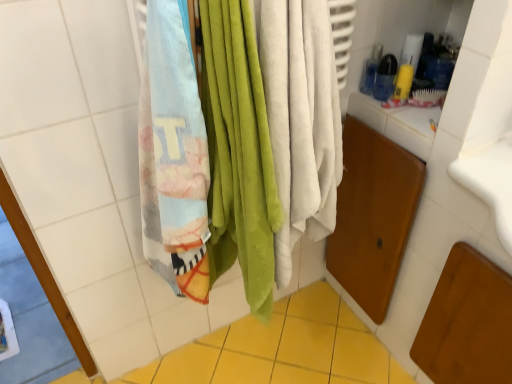
Question: In terms of height, does multicolored cotton beach towel at left look taller or shorter compared to yellow ceramic tile at lower center?

Choices:
 (A) tall
 (B) short

Answer: (A)

Question: In terms of width, does multicolored cotton beach towel at left look wider or thinner when compared to yellow ceramic tile at lower center?

Choices:
 (A) thin
 (B) wide

Answer: (A)

Question: From a real-world perspective, is multicolored cotton beach towel at left physically located above or below yellow ceramic tile at lower center?

Choices:
 (A) below
 (B) above

Answer: (B)

Question: Is yellow ceramic tile at lower center in front of or behind multicolored cotton beach towel at left in the image?

Choices:
 (A) behind
 (B) front

Answer: (A)

Question: From the image's perspective, is yellow ceramic tile at lower center located above or below multicolored cotton beach towel at left?

Choices:
 (A) above
 (B) below

Answer: (B)

Question: In terms of width, does yellow ceramic tile at lower center look wider or thinner when compared to multicolored cotton beach towel at left?

Choices:
 (A) wide
 (B) thin

Answer: (A)

Question: Does point (199, 370) appear closer or farther from the camera than point (158, 132)?

Choices:
 (A) closer
 (B) farther

Answer: (B)